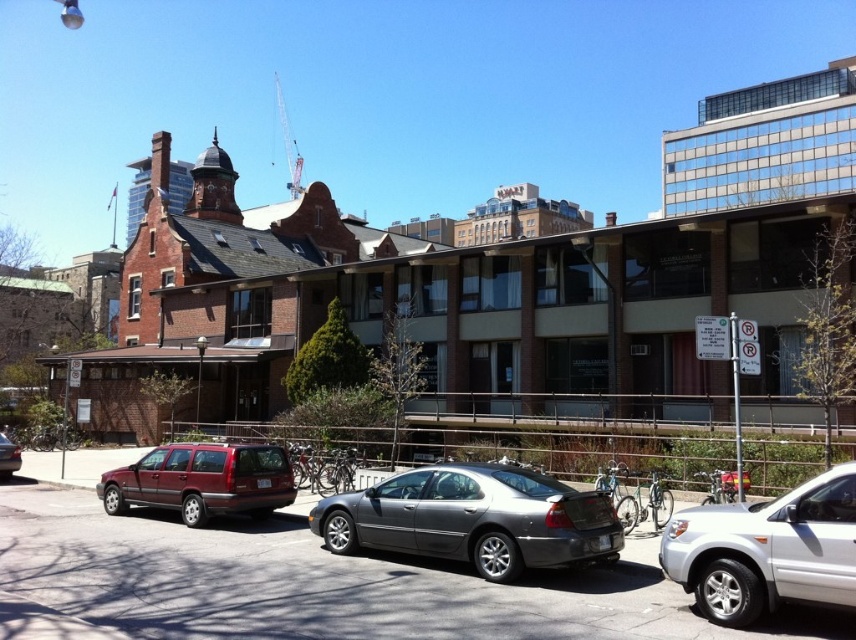
Does satin silver sedan at center appear over matte red station wagon at lower left?

Yes.

Which is below, satin silver sedan at center or matte red station wagon at lower left?

matte red station wagon at lower left

Where is `satin silver sedan at center`? This screenshot has height=640, width=856. satin silver sedan at center is located at coordinates (473, 518).

Does satin silver sedan at center appear under white matte suv at lower right?

Correct, satin silver sedan at center is located below white matte suv at lower right.

Is point (467, 508) positioned behind point (664, 532)?

Yes, point (467, 508) is farther from viewer.

Between point (485, 538) and point (744, 620), which one is positioned behind?

The point (485, 538) is behind.

This screenshot has width=856, height=640. I want to click on satin silver sedan at center, so click(x=473, y=518).

Which is more to the left, white matte suv at lower right or matte red station wagon at lower left?

matte red station wagon at lower left

Measure the distance between white matte suv at lower right and camera.

white matte suv at lower right and camera are 6.15 meters apart from each other.

Is point (822, 580) less distant than point (168, 506)?

Yes, it is.

Find the location of a particular element. This screenshot has height=640, width=856. white matte suv at lower right is located at coordinates (767, 550).